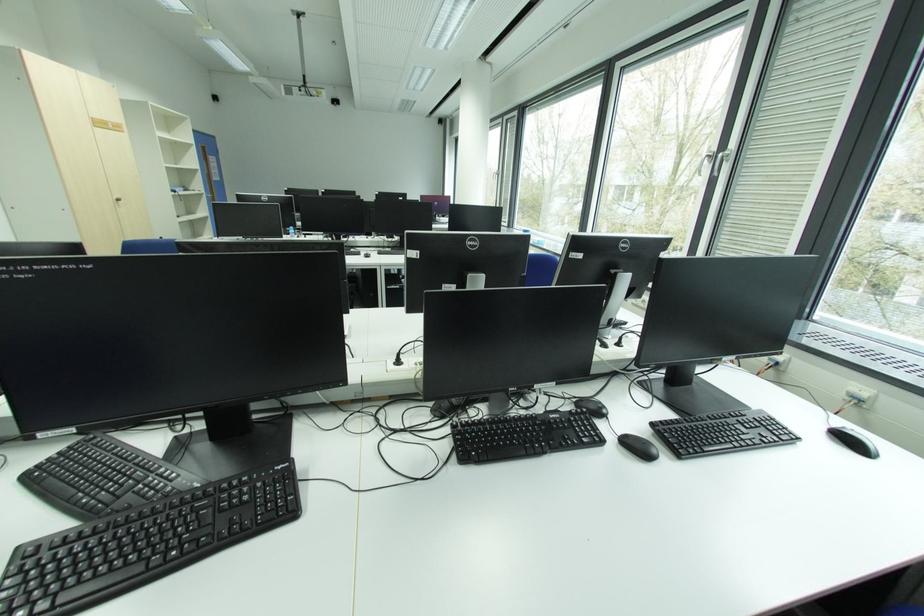
This screenshot has height=616, width=924. I want to click on silver window handle, so click(716, 161).